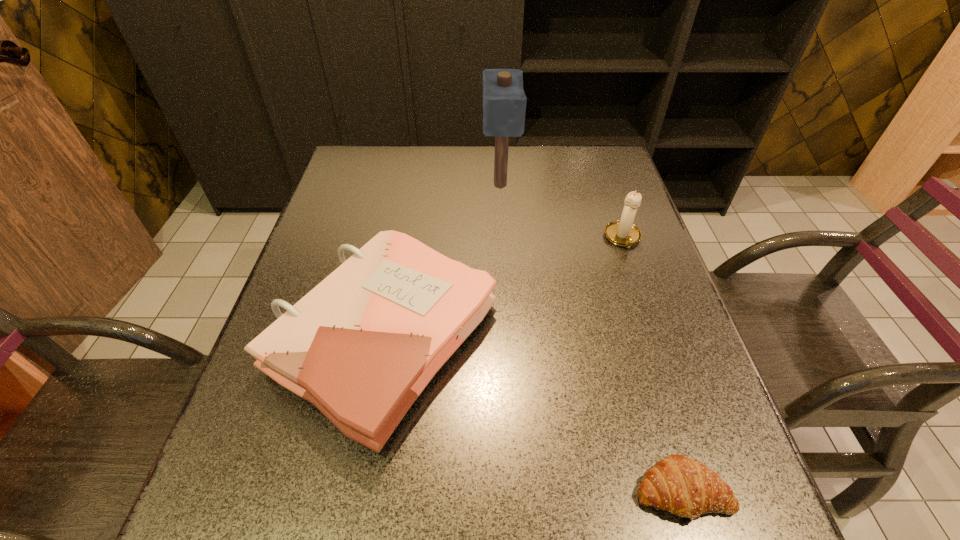
In the image, there is a desktop. Where is `blank space at the left edge`? This screenshot has width=960, height=540. blank space at the left edge is located at coordinates (306, 251).

In order to click on vacant space at the right edge of the desktop in this screenshot , I will do `click(611, 303)`.

In the image, there is a desktop. Where is `vacant region at the far left corner`? vacant region at the far left corner is located at coordinates (343, 166).

Find the location of a particular element. This screenshot has height=540, width=960. free location at the far right corner of the desktop is located at coordinates (607, 178).

In the image, there is a desktop. Where is `vacant space at the near right corner`? The height and width of the screenshot is (540, 960). vacant space at the near right corner is located at coordinates (691, 531).

Identify the location of free space between the shortest object and the second nearest object. (534, 415).

Find the location of a particular element. The width and height of the screenshot is (960, 540). vacant space in between the mallet and the crescent roll is located at coordinates pyautogui.click(x=591, y=338).

Locate an element on the screen. The image size is (960, 540). free space between the third tallest object and the candle holder is located at coordinates (504, 288).

The image size is (960, 540). I want to click on free point between the tallest object and the second farthest object, so tap(562, 211).

Identify the location of vacant space that is in between the third shortest object and the shortest object. The height and width of the screenshot is (540, 960). (653, 364).